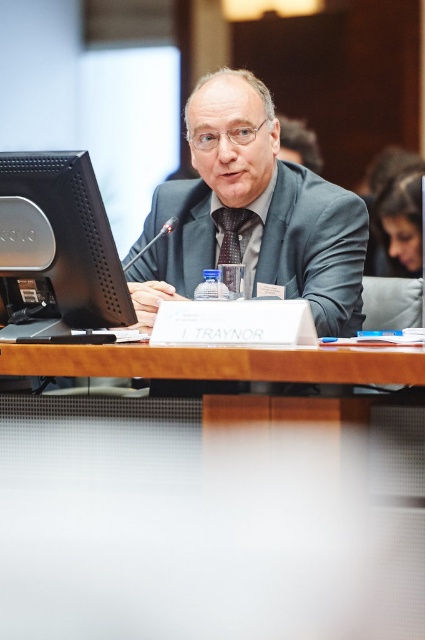
You are standing in the conference room and need to place a 10 cm wide object on the wooden table at center. The table has a coordinate system where the center is at point 0.5, 0.5. The wooden table at center is located at point (217, 362). Will the object fit on the table if you place it at the exact center coordinates?

The wooden table at center is located at point (217, 362), so placing the object at the exact center coordinates would mean placing it at 0.5, 0.5. Since the table is at (217, 362), the object would be slightly off the table. Therefore, it won